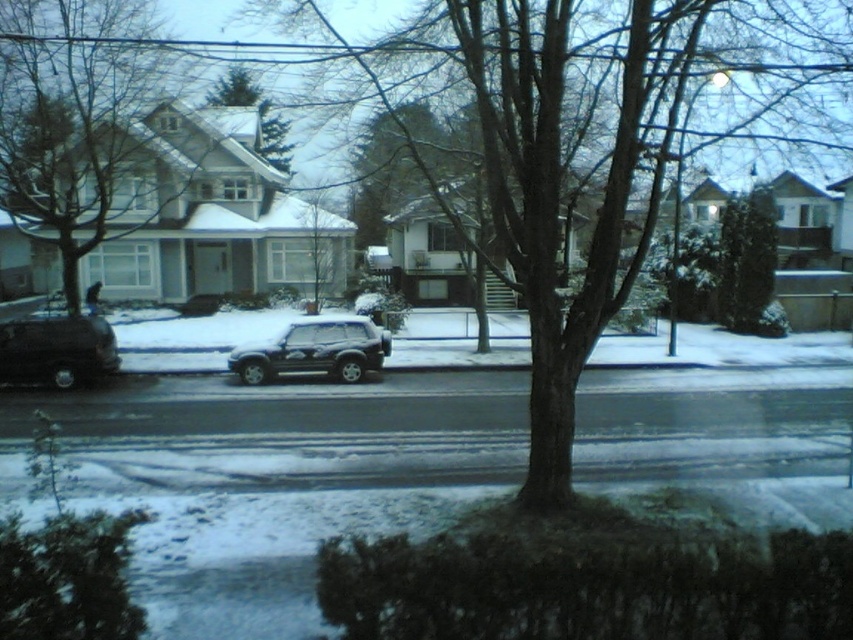
Who is higher up, brown textured tree at center or green leafy tree at right?

brown textured tree at center is higher up.

How distant is brown textured tree at center from green leafy tree at right?

brown textured tree at center is 13.31 meters away from green leafy tree at right.

Identify the location of brown textured tree at center. (598, 144).

Is point (323, 284) less distant than point (279, 125)?

Yes, it is.

Which is more to the left, green matte tree at center or green textured pine tree at upper center?

From the viewer's perspective, green textured pine tree at upper center appears more on the left side.

Describe the element at coordinates (323, 253) in the screenshot. The width and height of the screenshot is (853, 640). I see `green matte tree at center` at that location.

Locate an element on the screen. The image size is (853, 640). green matte tree at center is located at coordinates (323, 253).

Consider the image. Who is positioned more to the left, smooth white tree at center or shiny black suv at left?

Positioned to the left is smooth white tree at center.

Can you confirm if smooth white tree at center is positioned above shiny black suv at left?

Yes, smooth white tree at center is above shiny black suv at left.

This screenshot has height=640, width=853. Describe the element at coordinates (80, 124) in the screenshot. I see `smooth white tree at center` at that location.

Image resolution: width=853 pixels, height=640 pixels. Identify the location of smooth white tree at center. (80, 124).